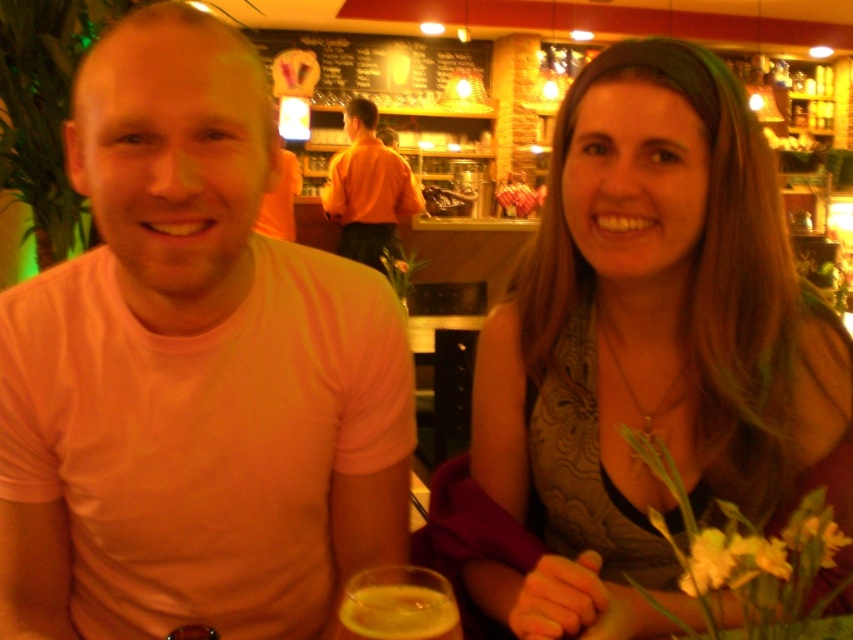
Question: Among these points, which one is nearest to the camera?

Choices:
 (A) (340, 236)
 (B) (577, 435)

Answer: (B)

Question: Is matte gray tank top at center positioned behind amber glass beer at lower center?

Choices:
 (A) yes
 (B) no

Answer: (A)

Question: Can you confirm if matte gray tank top at center is positioned below matte orange t-shirt at left?

Choices:
 (A) yes
 (B) no

Answer: (A)

Question: Is orange shirt at center positioned before matte orange t-shirt at left?

Choices:
 (A) no
 (B) yes

Answer: (A)

Question: Which point is farther to the camera?

Choices:
 (A) amber glass beer at lower center
 (B) matte orange t-shirt at left

Answer: (B)

Question: Estimate the real-world distances between objects in this image. Which object is farther from the matte gray tank top at center?

Choices:
 (A) amber glass beer at lower center
 (B) orange shirt at center
 (C) matte orange t-shirt at left
 (D) pink cotton shirt at center

Answer: (C)